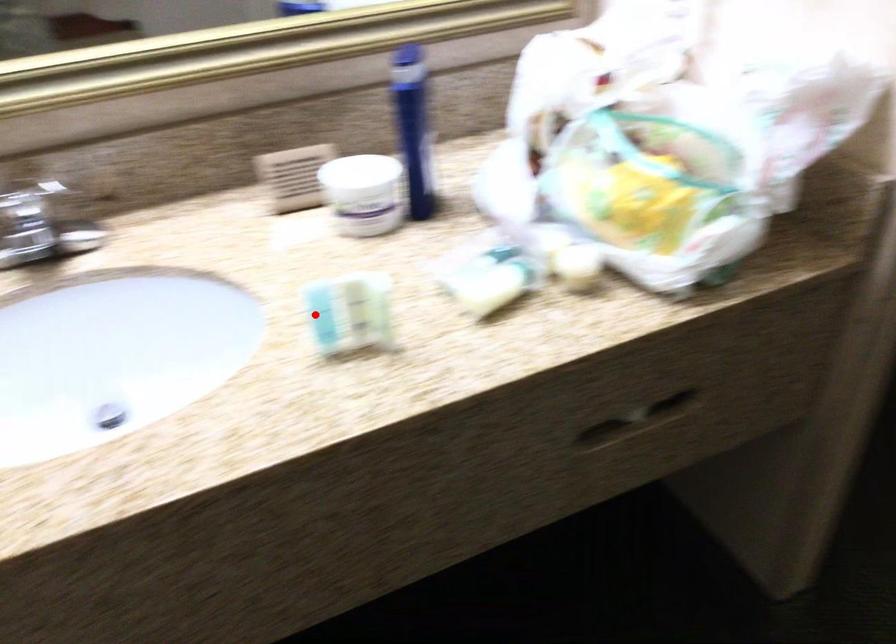
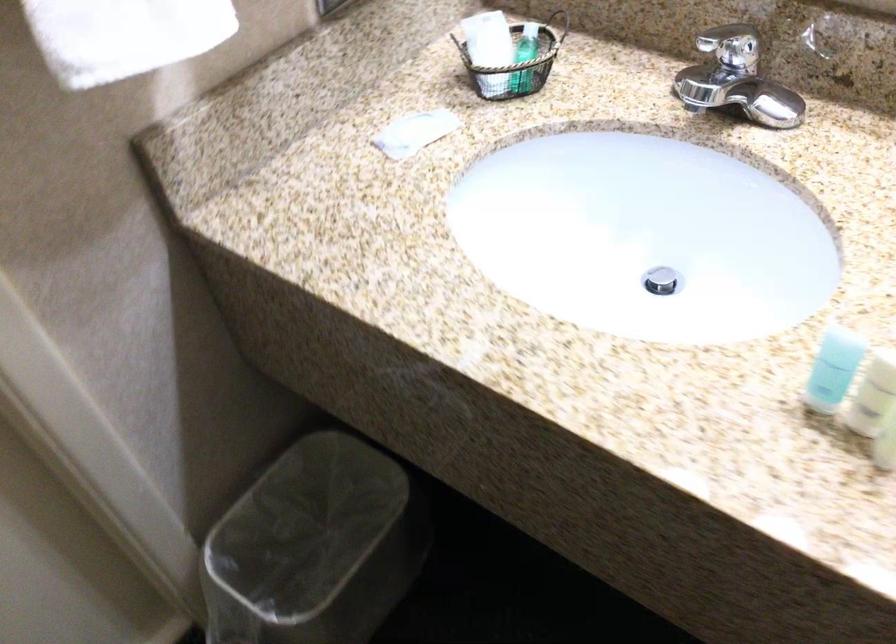
Question: I am providing you with two images of the same scene from different viewpoints. Given a red point in image1, look at the same physical point in image2. Is it:

Choices:
 (A) Closer to the viewpoint
 (B) Farther from the viewpoint

Answer: (A)